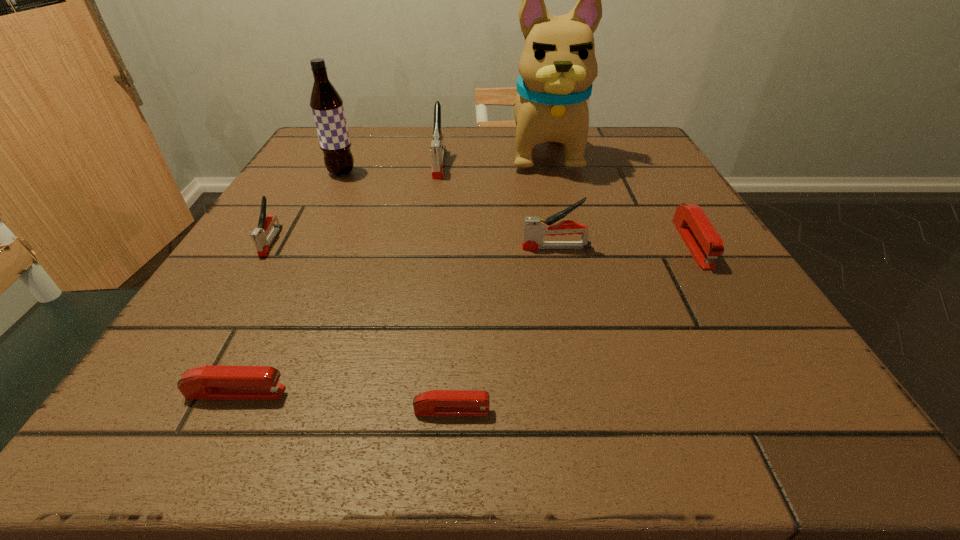
The width and height of the screenshot is (960, 540). Find the location of `the second closest stapler relative to the biggest red stapler`. the second closest stapler relative to the biggest red stapler is located at coordinates click(436, 402).

Point out which stapler is positioned as the third nearest to the second shortest stapler. Please provide its 2D coordinates. Your answer should be formatted as a tuple, i.e. [(x, y)], where the tuple contains the x and y coordinates of a point satisfying the conditions above.

[(535, 228)]

Point out which gray stapler is positioned as the second nearest to the tallest stapler. Please provide its 2D coordinates. Your answer should be formatted as a tuple, i.e. [(x, y)], where the tuple contains the x and y coordinates of a point satisfying the conditions above.

[(262, 244)]

Select which gray stapler is the second closest to the fourth stapler from right to left. Please provide its 2D coordinates. Your answer should be formatted as a tuple, i.e. [(x, y)], where the tuple contains the x and y coordinates of a point satisfying the conditions above.

[(262, 244)]

Identify which red stapler is the second closest to the nearest object. Please provide its 2D coordinates. Your answer should be formatted as a tuple, i.e. [(x, y)], where the tuple contains the x and y coordinates of a point satisfying the conditions above.

[(704, 243)]

The height and width of the screenshot is (540, 960). Identify the location of red stapler that is the second closest to the third shortest object. (209, 381).

At what (x,y) coordinates should I click in order to perform the action: click on vacant position in the image that satisfies the following two spatial constraints: 1. on the handle side of the tallest stapler; 2. on the front-facing side of the fifth tallest stapler. Please return your answer as a coordinate pair (x, y). Looking at the image, I should click on (405, 393).

You are a GUI agent. You are given a task and a screenshot of the screen. Output one action in this format:
    pyautogui.click(x=<x>, y=<y>)
    Task: Click on the free space in the image that satisfies the following two spatial constraints: 1. on the face of the tallest object; 2. on the front-facing side of the fifth stapler from right to left
    Image resolution: width=960 pixels, height=540 pixels.
    Given the screenshot: What is the action you would take?
    (x=606, y=393)

Image resolution: width=960 pixels, height=540 pixels. Identify the location of free space that satisfies the following two spatial constraints: 1. on the front-facing side of the rightmost red stapler; 2. on the handle side of the fifth shortest stapler. (694, 247).